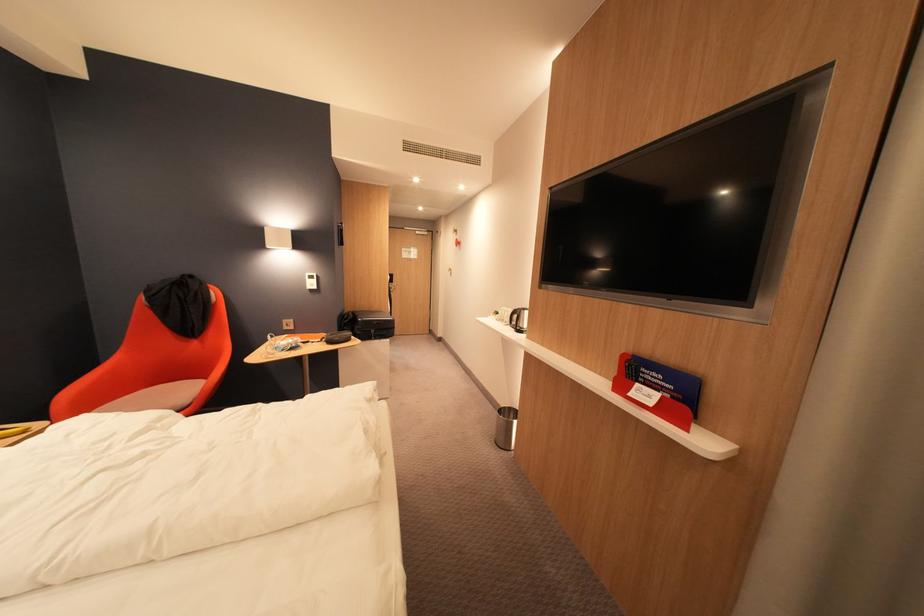
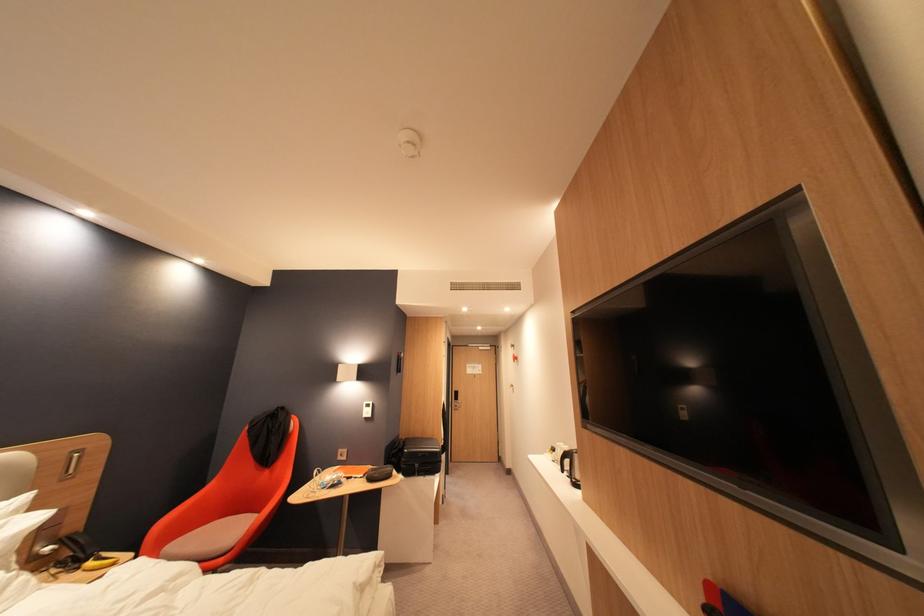
In the second image, find the point that corresponds to [383,331] in the first image.

(427, 467)